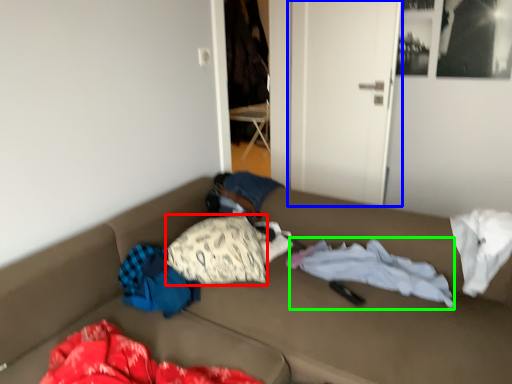
Question: Which object is positioned farthest from pillow (highlighted by a red box)? Select from door (highlighted by a blue box) and blanket (highlighted by a green box).

Choices:
 (A) door
 (B) blanket

Answer: (A)